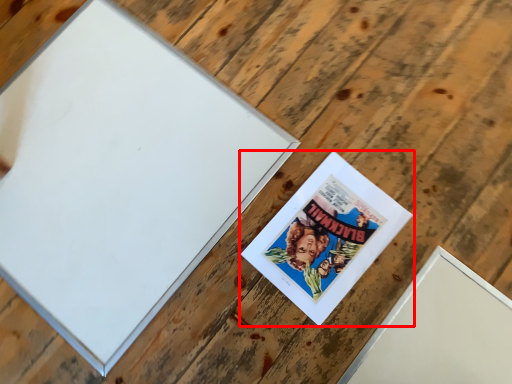
Question: Considering the relative positions of picture frame (annotated by the red box) and picture frame in the image provided, where is picture frame (annotated by the red box) located with respect to the staircase?

Choices:
 (A) left
 (B) right

Answer: (B)